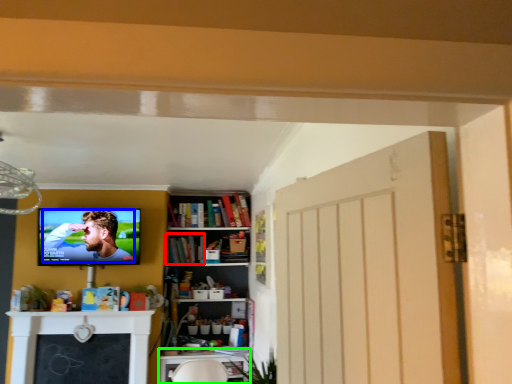
Question: Considering the real-world distances, which object is closest to book (highlighted by a red box)? person (highlighted by a blue box) or table (highlighted by a green box).

Choices:
 (A) person
 (B) table

Answer: (A)